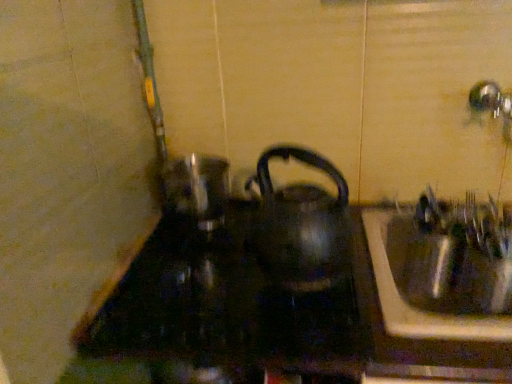
Measure the distance between black glossy kettle at center and camera.

28.55 inches.

The width and height of the screenshot is (512, 384). Find the location of `metallic sink at right`. metallic sink at right is located at coordinates (416, 309).

Is black glossy kettle at center beside metallic sink at right?

black glossy kettle at center and metallic sink at right are clearly separated.

Between black glossy kettle at center and metallic sink at right, which one appears on the left side from the viewer's perspective?

Positioned to the left is black glossy kettle at center.

Who is shorter, black glossy kettle at center or metallic sink at right?

With less height is metallic sink at right.

From the image's perspective, is black glossy kettle at center above metallic sink at right?

Yes, from the image's perspective, black glossy kettle at center is on top of metallic sink at right.

Between black glass stove at center and black glossy kettle at center, which one has smaller size?

black glossy kettle at center is smaller.

From the picture: Is there a large distance between black glass stove at center and black glossy kettle at center?

No, there isn't a large distance between black glass stove at center and black glossy kettle at center.

How different are the orientations of black glass stove at center and black glossy kettle at center in degrees?

The facing directions of black glass stove at center and black glossy kettle at center are 1.95 degrees apart.

Consider the image. In the image, is black glass stove at center positioned in front of or behind black glossy kettle at center?

black glass stove at center is positioned closer to the viewer than black glossy kettle at center.

Are black glass stove at center and metallic sink at right far apart?

No, black glass stove at center is not far away from metallic sink at right.

Do you think black glass stove at center is within metallic sink at right, or outside of it?

black glass stove at center lies outside metallic sink at right.

Find the location of `counter top above the metallic sink at right (from the image's perspective)`. counter top above the metallic sink at right (from the image's perspective) is located at coordinates (318, 301).

Does point (422, 325) come behind point (462, 322)?

No, it is in front of (462, 322).

Can you tell me how much metallic sink at right and black glossy kettle at center differ in facing direction?

2.76 degrees separate the facing orientations of metallic sink at right and black glossy kettle at center.

Can you confirm if metallic sink at right is positioned to the left of black glossy kettle at center?

Incorrect, metallic sink at right is not on the left side of black glossy kettle at center.

Is metallic sink at right in front of or behind black glossy kettle at center in the image?

In the image, metallic sink at right appears behind black glossy kettle at center.

Which of these two, metallic sink at right or black glossy kettle at center, stands shorter?

With less height is metallic sink at right.

Who is shorter, black glossy kettle at center or black glass stove at center?

With less height is black glass stove at center.

The image size is (512, 384). I want to click on kettle to the right of black glass stove at center, so click(x=300, y=222).

Could you tell me if black glossy kettle at center is facing black glass stove at center?

No, black glossy kettle at center is not oriented towards black glass stove at center.

From the image's perspective, is metallic sink at right above or below black glass stove at center?

metallic sink at right is below black glass stove at center.

I want to click on counter top above the metallic sink at right (from the image's perspective), so click(318, 301).

Considering the sizes of objects metallic sink at right and black glass stove at center in the image provided, who is smaller, metallic sink at right or black glass stove at center?

With smaller size is metallic sink at right.

Where is `kettle above the metallic sink at right (from the image's perspective)`? This screenshot has height=384, width=512. kettle above the metallic sink at right (from the image's perspective) is located at coordinates (300, 222).

Identify the location of counter top that appears below the black glossy kettle at center (from the image's perspective). The width and height of the screenshot is (512, 384). (318, 301).

Estimate the real-world distances between objects in this image. Which object is closer to black glossy kettle at center, metallic sink at right or black glass stove at center?

The object closer to black glossy kettle at center is black glass stove at center.

Which object lies nearer to the anchor point metallic sink at right, black glass stove at center or black glossy kettle at center?

Based on the image, black glass stove at center appears to be nearer to metallic sink at right.

From the image, which object appears to be nearer to black glass stove at center, black glossy kettle at center or metallic sink at right?

metallic sink at right is closer to black glass stove at center.

Looking at the image, which one is located closer to black glass stove at center, metallic sink at right or black glossy kettle at center?

metallic sink at right lies closer to black glass stove at center than the other object.

Looking at this image, considering their positions, is black glossy kettle at center positioned closer to metallic sink at right than black glass stove at center?

The object closer to metallic sink at right is black glass stove at center.

Estimate the real-world distances between objects in this image. Which object is further from black glossy kettle at center, black glass stove at center or metallic sink at right?

metallic sink at right.

In order to click on kettle between black glass stove at center and metallic sink at right in this screenshot , I will do `click(300, 222)`.